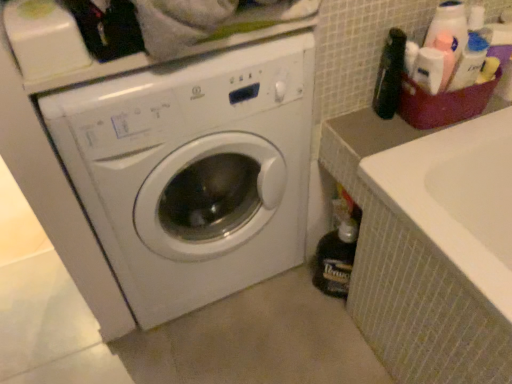
You are a GUI agent. You are given a task and a screenshot of the screen. Output one action in this format:
    pyautogui.click(x=<x>, y=<y>)
    Task: Click on the vacant position to the left of plastic basket at upper right
    This screenshot has width=512, height=384.
    Given the screenshot: What is the action you would take?
    pyautogui.click(x=372, y=132)